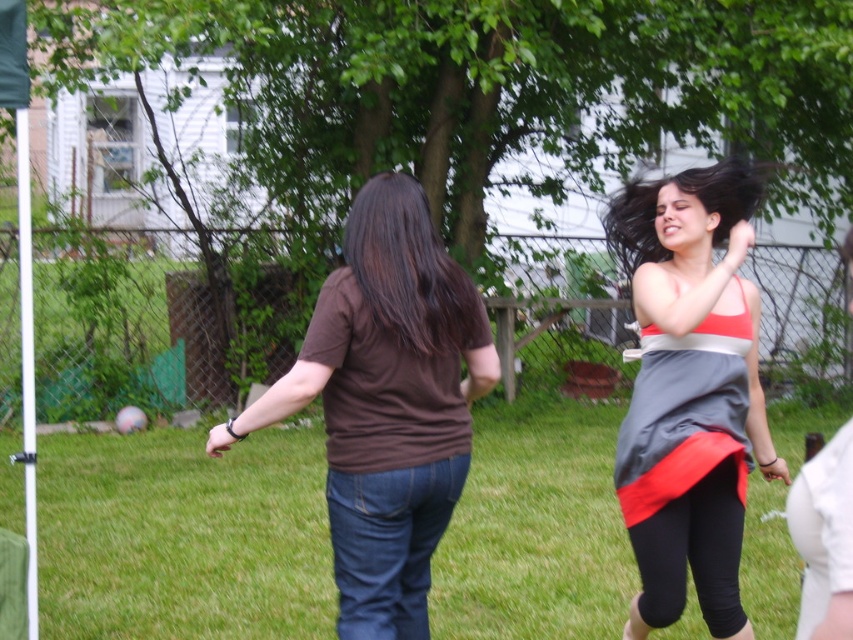
Who is positioned more to the right, green grass at center or brown cotton t-shirt at center?

brown cotton t-shirt at center

What do you see at coordinates (183, 536) in the screenshot? I see `green grass at center` at bounding box center [183, 536].

I want to click on green grass at center, so click(183, 536).

Does brown cotton t-shirt at center appear under gray satin dress at right?

Incorrect, brown cotton t-shirt at center is not positioned below gray satin dress at right.

Is point (398, 340) farther from viewer compared to point (740, 422)?

That is False.

Where is `brown cotton t-shirt at center`? brown cotton t-shirt at center is located at coordinates (386, 403).

Does green grass at center appear on the right side of gray satin dress at right?

In fact, green grass at center is to the left of gray satin dress at right.

Can you confirm if green grass at center is taller than gray satin dress at right?

In fact, green grass at center may be shorter than gray satin dress at right.

Between point (473, 605) and point (693, 196), which one is positioned in front?

Point (693, 196) is in front.

Where is `green grass at center`? The image size is (853, 640). green grass at center is located at coordinates (183, 536).